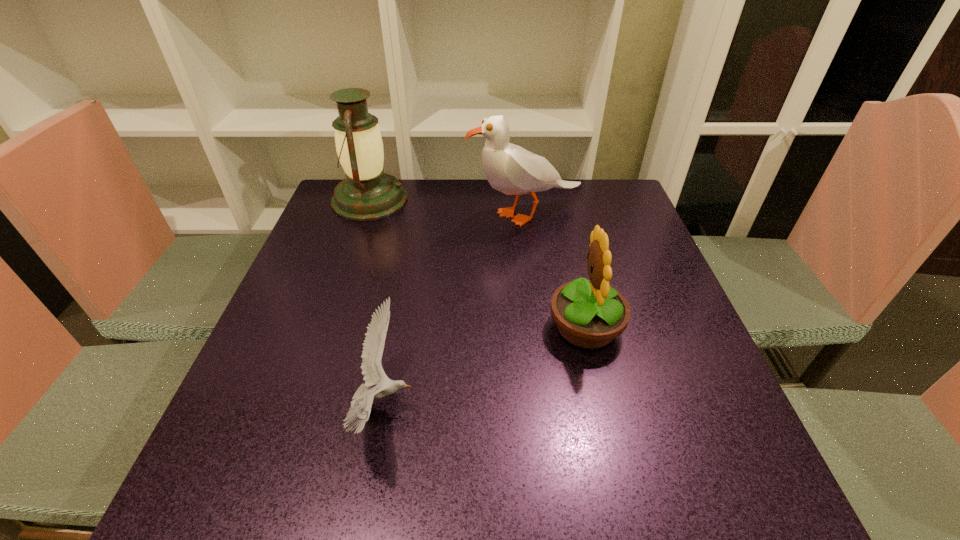
At what (x,y) coordinates should I click in order to perform the action: click on empty space between the lantern and the right gull. Please return your answer as a coordinate pair (x, y). This screenshot has height=540, width=960. Looking at the image, I should click on [x=447, y=207].

Where is `free area in between the second shortest object and the lantern`? free area in between the second shortest object and the lantern is located at coordinates (477, 263).

Image resolution: width=960 pixels, height=540 pixels. In order to click on vacant space that's between the lantern and the shortest object in this screenshot , I will do tap(376, 302).

You are a GUI agent. You are given a task and a screenshot of the screen. Output one action in this format:
    pyautogui.click(x=<x>, y=<y>)
    Task: Click on the vacant area that lies between the farther gull and the third tallest object
    The height and width of the screenshot is (540, 960).
    Given the screenshot: What is the action you would take?
    pyautogui.click(x=555, y=271)

This screenshot has width=960, height=540. In order to click on free spot between the taller gull and the lantern in this screenshot , I will do `click(447, 207)`.

At what (x,y) coordinates should I click in order to perform the action: click on free spot between the shortest object and the lantern. Please return your answer as a coordinate pair (x, y). Looking at the image, I should click on (376, 302).

Locate an element on the screen. The height and width of the screenshot is (540, 960). free space between the lantern and the sunflower is located at coordinates (477, 263).

This screenshot has width=960, height=540. In order to click on unoccupied position between the nearer gull and the sunflower in this screenshot , I will do (x=484, y=366).

Identify the location of the second closest object to the sunflower. (373, 346).

This screenshot has height=540, width=960. Find the location of `object identified as the closest to the taller gull`. object identified as the closest to the taller gull is located at coordinates (367, 193).